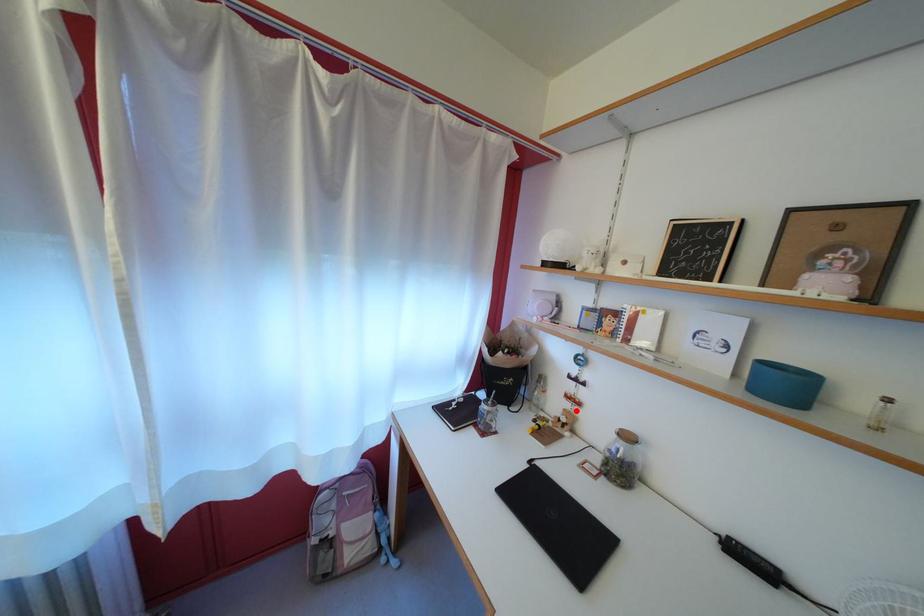
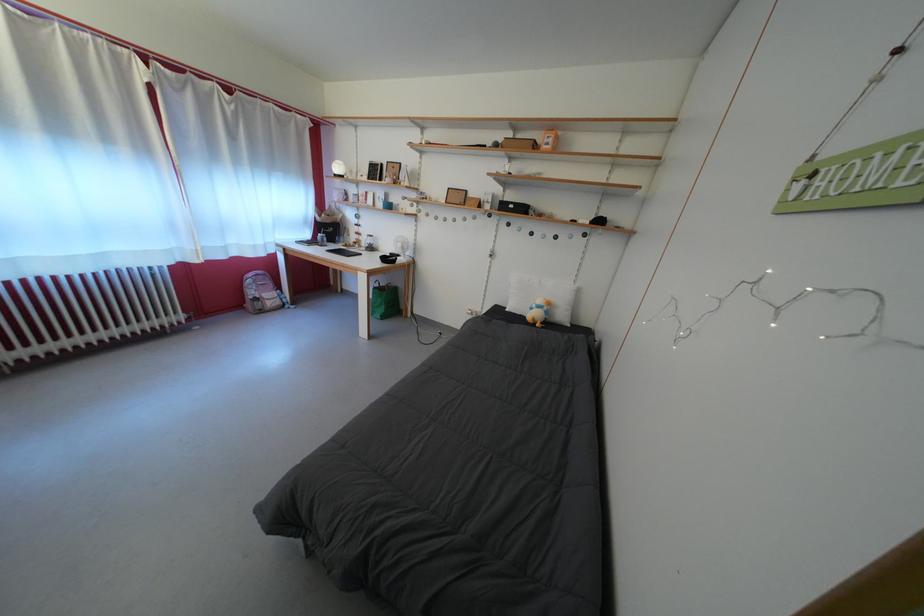
Find the pixel in the second image that matches the highlighted location in the first image.

(365, 243)